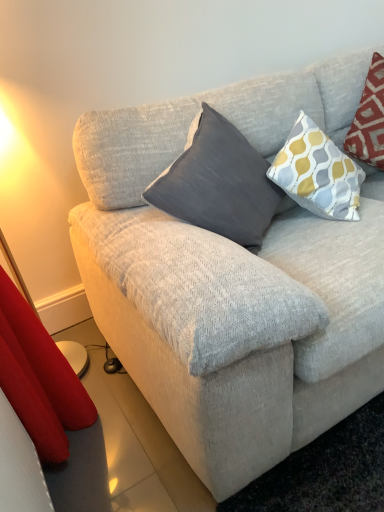
Question: Should I look upward or downward to see matte gold table lamp at left?

Choices:
 (A) down
 (B) up

Answer: (B)